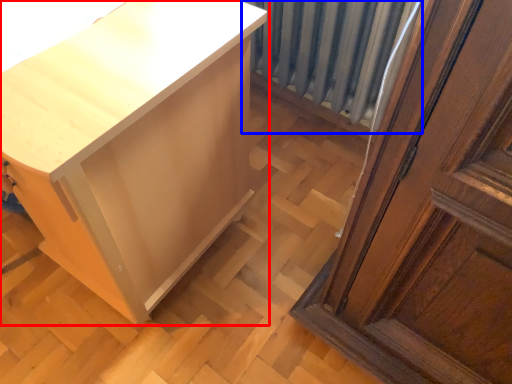
Question: Which point is closer to the camera, furniture (highlighted by a red box) or radiator (highlighted by a blue box)?

Choices:
 (A) furniture
 (B) radiator

Answer: (A)